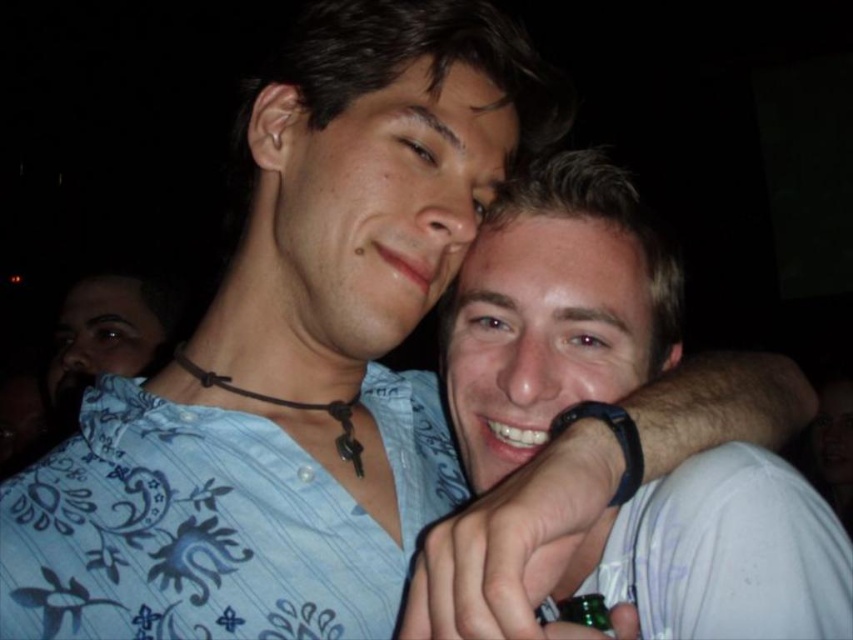
Question: Which of the following is the closest to the observer?

Choices:
 (A) (90, 355)
 (B) (541, 244)

Answer: (B)

Question: Can you confirm if matte blue shirt at center is bigger than matte skin at lower left?

Choices:
 (A) yes
 (B) no

Answer: (B)

Question: Is matte blue shirt at center bigger than matte skin at lower left?

Choices:
 (A) no
 (B) yes

Answer: (A)

Question: Can you confirm if matte blue shirt at center is positioned to the left of matte skin at lower left?

Choices:
 (A) no
 (B) yes

Answer: (A)

Question: Considering the real-world distances, which object is farthest from the smooth skin face at center?

Choices:
 (A) matte blue shirt at center
 (B) white matte shirt at center
 (C) matte skin at lower left

Answer: (C)

Question: Which object is positioned closest to the matte skin at lower left?

Choices:
 (A) white matte shirt at center
 (B) smooth skin face at center
 (C) matte blue shirt at center

Answer: (C)